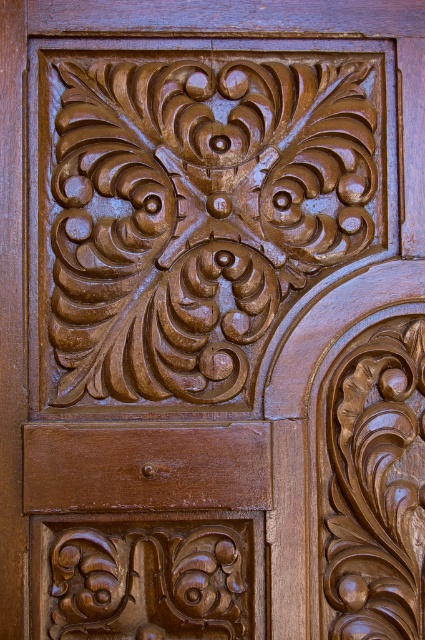
Can you confirm if brown carved wood at center is thinner than matte brown wood at lower center?

No, brown carved wood at center is not thinner than matte brown wood at lower center.

Who is more forward, (x=268, y=154) or (x=189, y=608)?

Positioned in front is point (x=189, y=608).

Image resolution: width=425 pixels, height=640 pixels. I want to click on brown carved wood at center, so click(x=197, y=216).